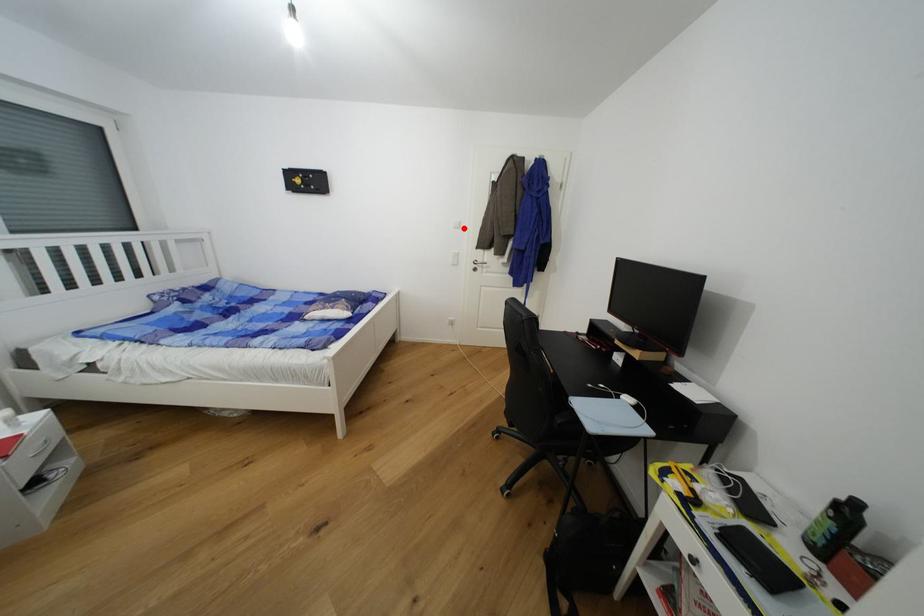
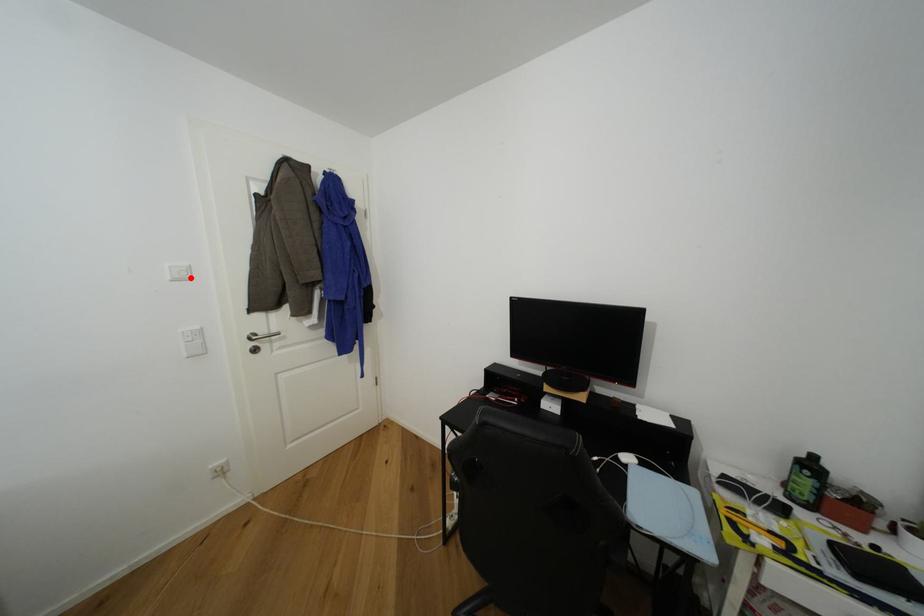
I am providing you with two images of the same scene from different viewpoints. A red point is marked on the first image and another point is marked on the second image. Are the points marked in image1 and image2 representing the same 3D position?

Yes